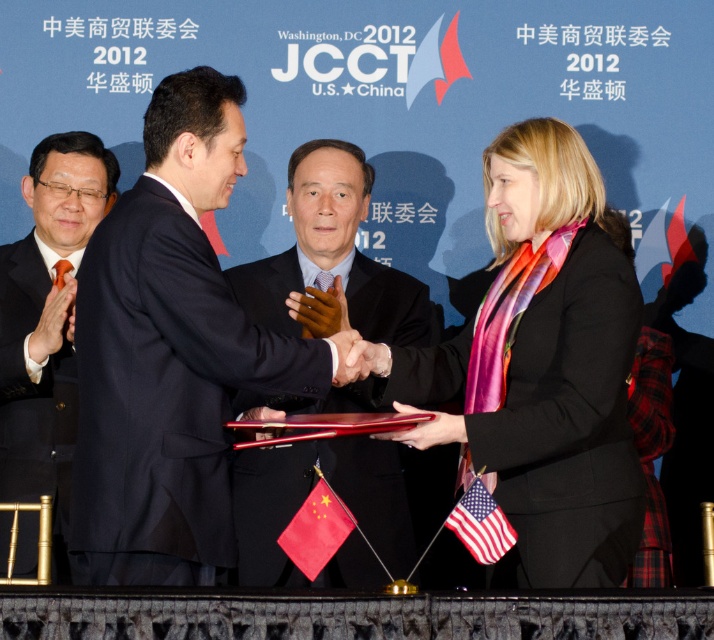
You are a photographer standing at the back of the room. You want to take a photo of the dark blue suit at center and the black suit at left so that both are in focus. The camera you are using has a depth of field that can cover 8 feet. Will both subjects be in focus?

The dark blue suit at center and the black suit at left are 8.86 feet apart. Since the depth of field can only cover 8 feet, the distance between them exceeds the camera s capability. Therefore, both subjects cannot be in focus simultaneously.